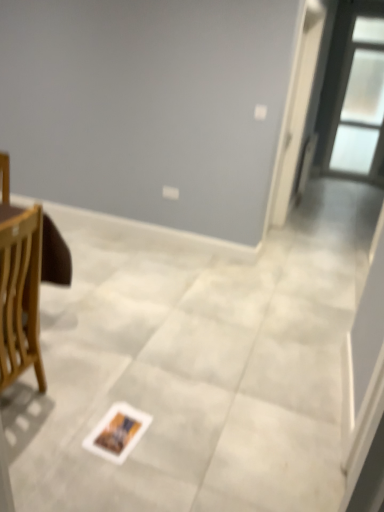
At what (x,y) coordinates should I click in order to perform the action: click on vacant space in front of white glossy screen door at upper right. Please return your answer as a coordinate pair (x, y). Looking at the image, I should click on (302, 259).